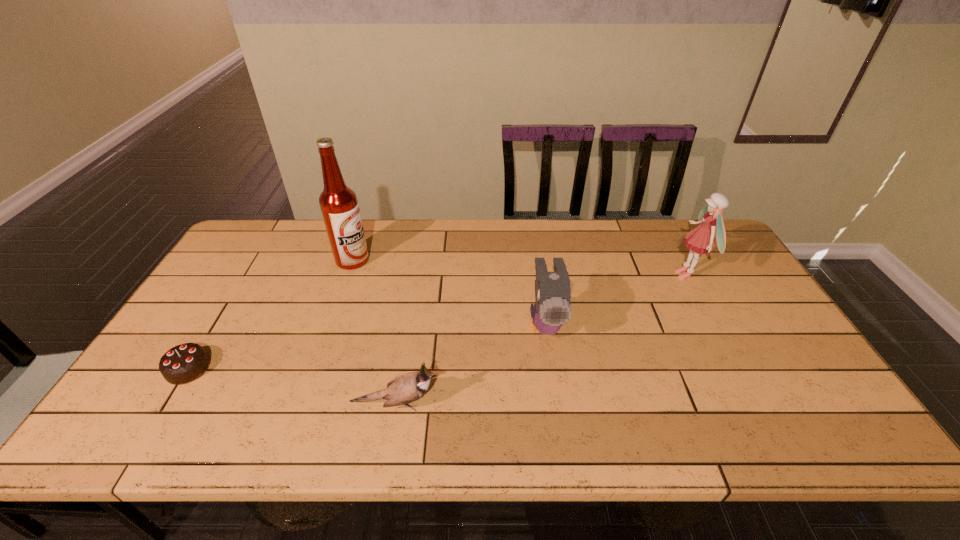
You are a GUI agent. You are given a task and a screenshot of the screen. Output one action in this format:
    pyautogui.click(x=<x>, y=<y>)
    Task: Click on the object that is at the left edge
    
    Given the screenshot: What is the action you would take?
    pyautogui.click(x=184, y=363)

You are a GUI agent. You are given a task and a screenshot of the screen. Output one action in this format:
    pyautogui.click(x=<x>, y=<y>)
    Task: Click on the object that is at the right edge
    This screenshot has width=960, height=540.
    Given the screenshot: What is the action you would take?
    pyautogui.click(x=701, y=239)

Find the location of a particular element. The image size is (960, 540). object situated at the far right corner is located at coordinates (701, 239).

At what (x,y) coordinates should I click in order to perform the action: click on vacant space at the far edge of the desktop. Please return your answer as a coordinate pair (x, y). The width and height of the screenshot is (960, 540). Looking at the image, I should click on (522, 255).

Identify the location of vacant region at the near edge. (748, 433).

This screenshot has height=540, width=960. I want to click on free spot at the left edge of the desktop, so click(x=132, y=402).

You are a GUI agent. You are given a task and a screenshot of the screen. Output one action in this format:
    pyautogui.click(x=<x>, y=<y>)
    Task: Click on the vacant space at the right edge of the desktop
    The image size is (960, 540).
    Given the screenshot: What is the action you would take?
    pyautogui.click(x=694, y=275)

At what (x,y) coordinates should I click in order to perform the action: click on vacant space at the far left corner of the desktop. Please return your answer as a coordinate pair (x, y). Looking at the image, I should click on point(259,241).

You are a GUI agent. You are given a task and a screenshot of the screen. Output one action in this format:
    pyautogui.click(x=<x>, y=<y>)
    Task: Click on the blank area at the near left corner
    This screenshot has height=540, width=960.
    Given the screenshot: What is the action you would take?
    pyautogui.click(x=106, y=440)

Find the location of a particular element. The width and height of the screenshot is (960, 540). vacant point located between the nearest object and the second tallest object is located at coordinates (541, 340).